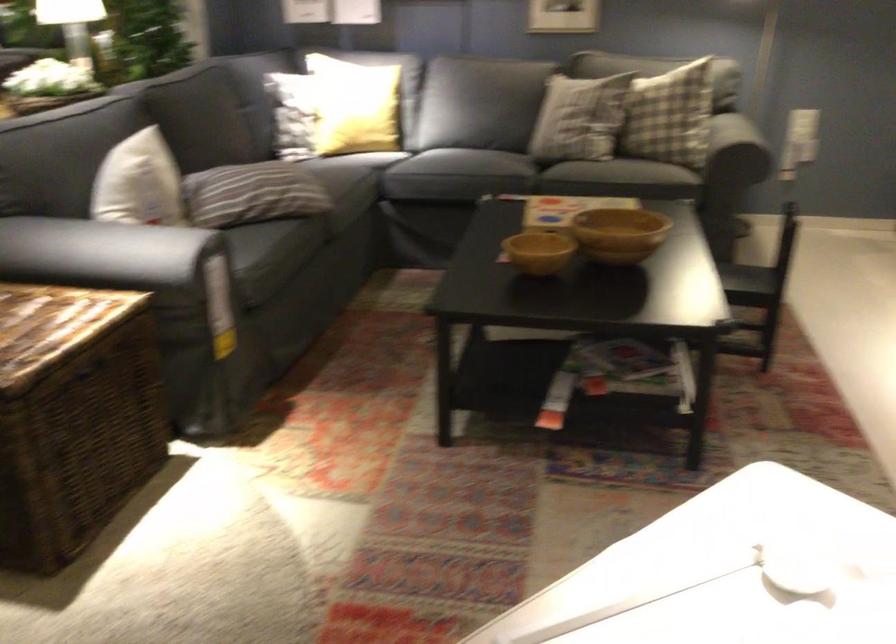
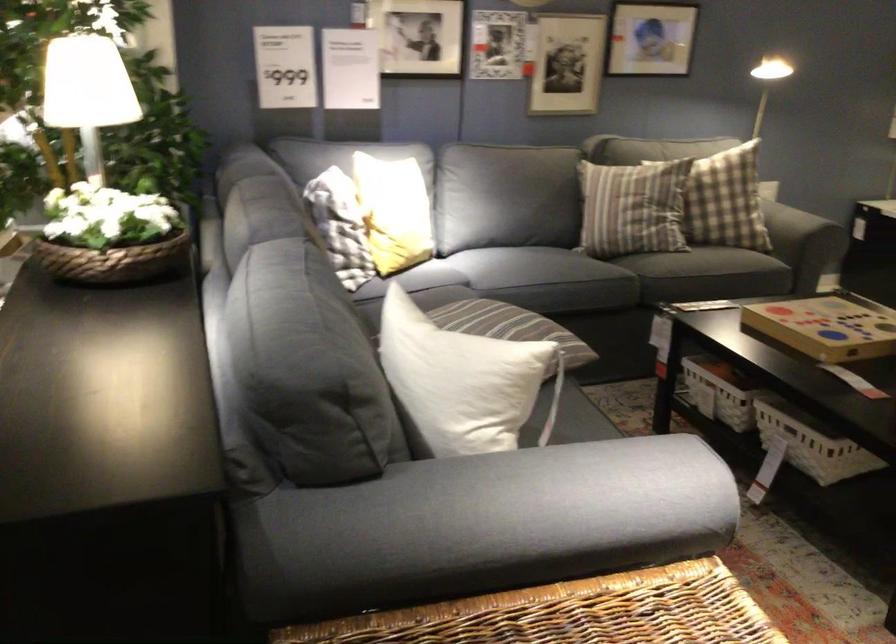
Question: I am providing you with two images of the same scene from different viewpoints. After the viewpoint changes to image2, which objects are now occluded?

Choices:
 (A) yellow throw pillow
 (B) plaid pillow
 (C) woven flower basket
 (D) black bag handle

Answer: (B)